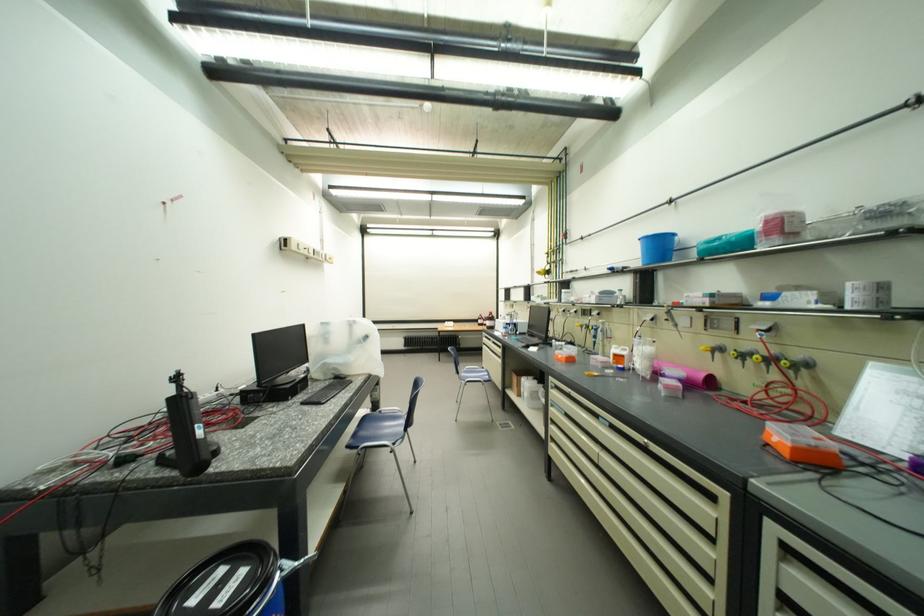
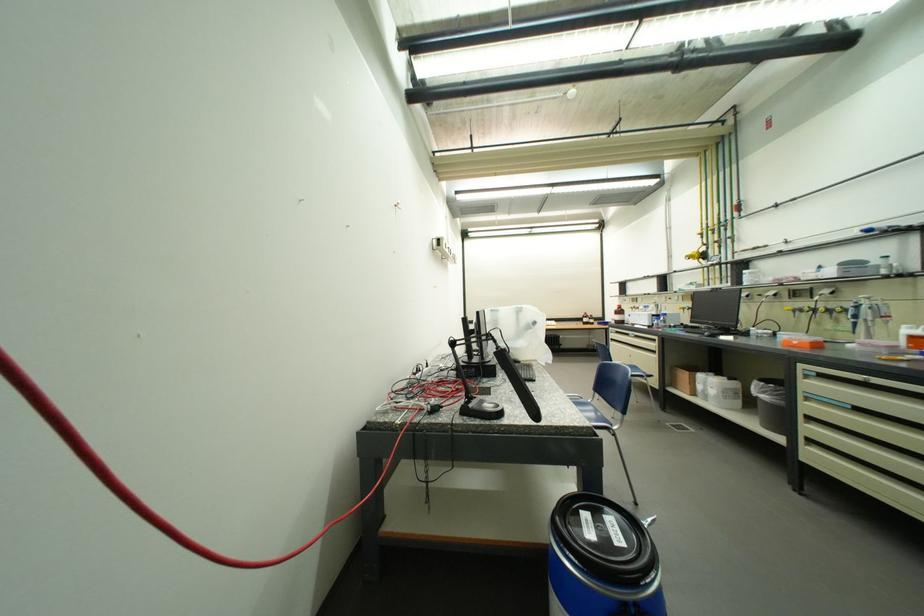
Find the pixel in the second image that matches (x=596, y=326) in the first image.

(819, 309)